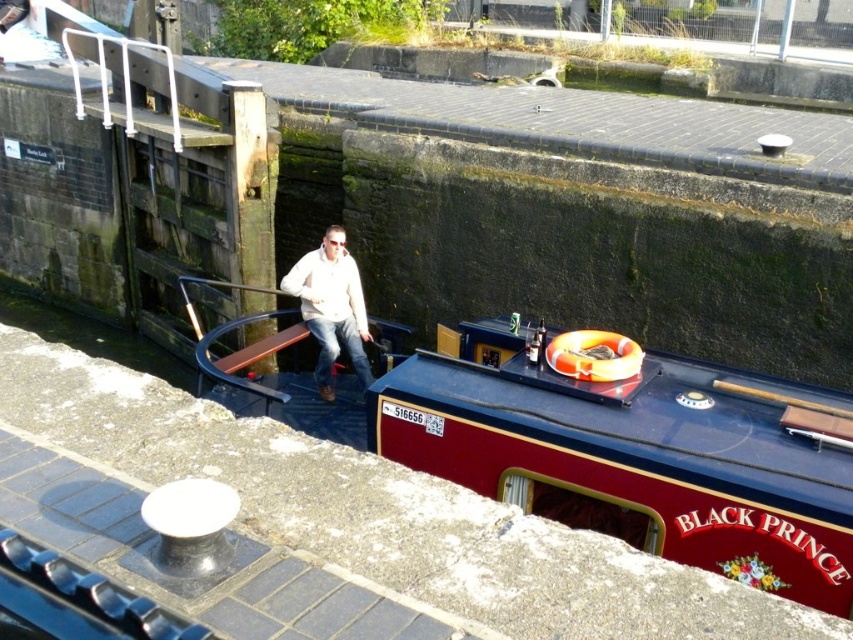
Does maroon polished wood boat at center appear over white matte jacket at center?

Incorrect, maroon polished wood boat at center is not positioned above white matte jacket at center.

Which is above, maroon polished wood boat at center or white matte jacket at center?

white matte jacket at center is higher up.

Which is in front, point (572, 378) or point (309, 323)?

Point (572, 378) is more forward.

Where is `maroon polished wood boat at center`? The image size is (853, 640). maroon polished wood boat at center is located at coordinates (634, 452).